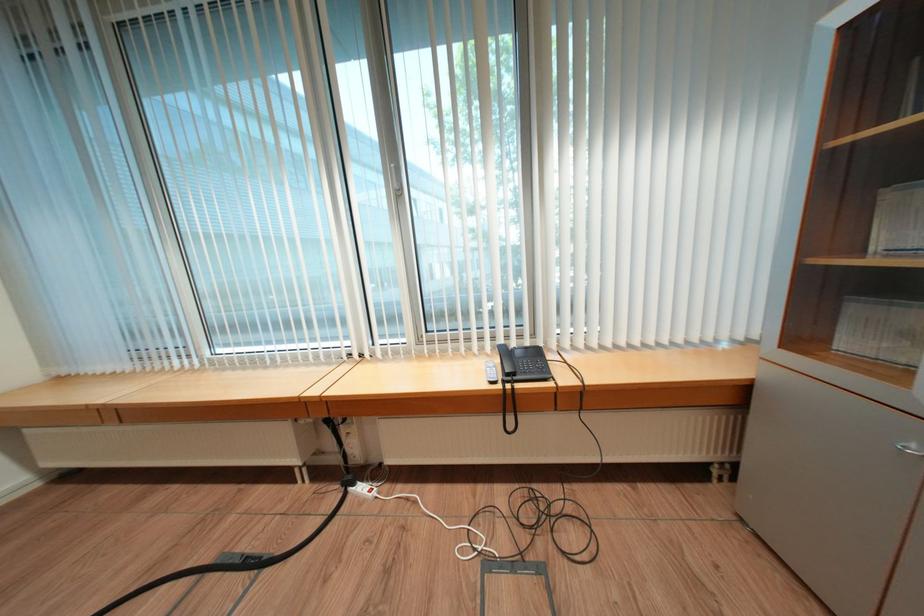
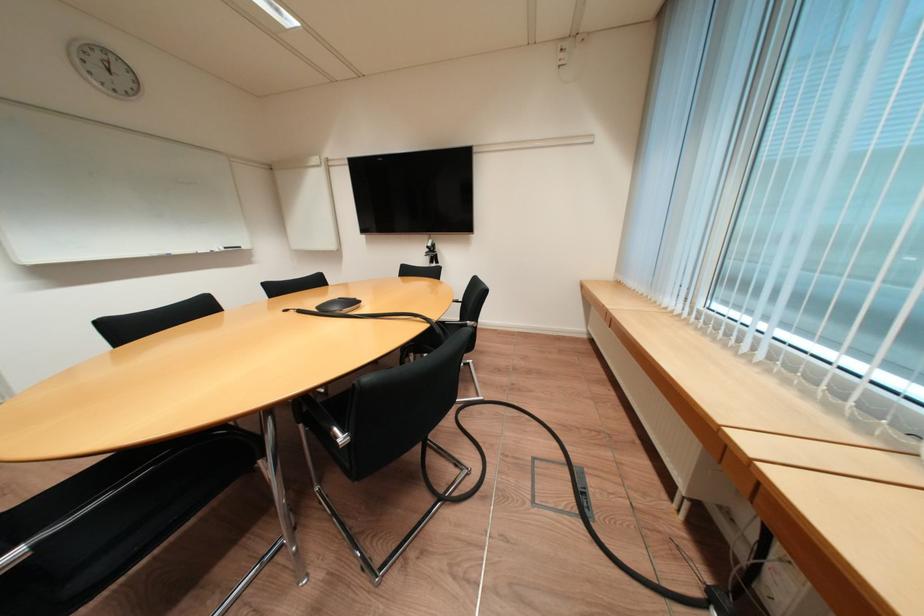
Based on the continuous images, in which direction is the camera rotating?

The camera rotated toward left-down.